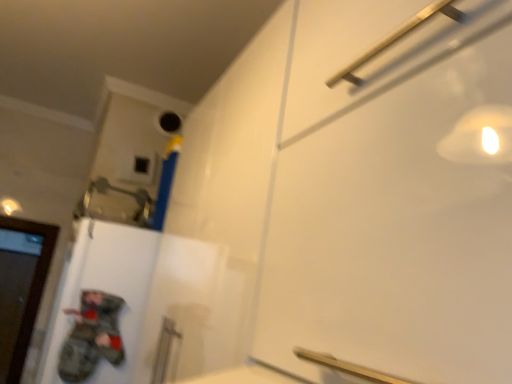
Question: In the image, is wooden door at left positioned in front of or behind camouflage fabric pants at lower left?

Choices:
 (A) front
 (B) behind

Answer: (B)

Question: From the image's perspective, is wooden door at left positioned above or below camouflage fabric pants at lower left?

Choices:
 (A) below
 (B) above

Answer: (A)

Question: Would you say wooden door at left is inside or outside camouflage fabric pants at lower left?

Choices:
 (A) outside
 (B) inside

Answer: (A)

Question: Looking at their shapes, would you say camouflage fabric pants at lower left is wider or thinner than wooden door at left?

Choices:
 (A) thin
 (B) wide

Answer: (A)

Question: Is camouflage fabric pants at lower left inside the boundaries of wooden door at left, or outside?

Choices:
 (A) inside
 (B) outside

Answer: (B)

Question: Is camouflage fabric pants at lower left taller or shorter than wooden door at left?

Choices:
 (A) short
 (B) tall

Answer: (A)

Question: Looking at the image, does camouflage fabric pants at lower left seem bigger or smaller compared to wooden door at left?

Choices:
 (A) small
 (B) big

Answer: (A)